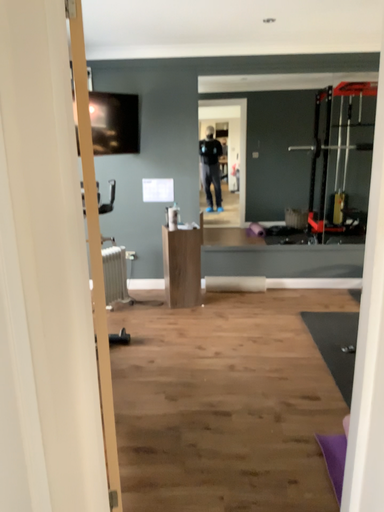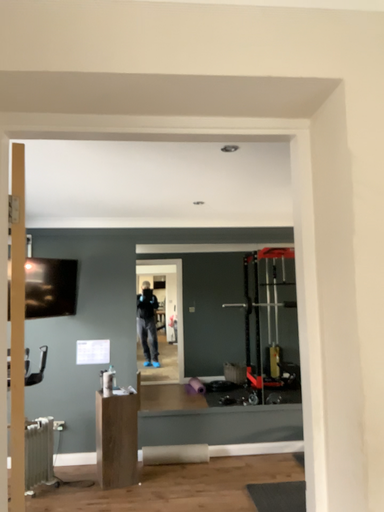
Question: How did the camera likely rotate when shooting the video?

Choices:
 (A) rotated upward
 (B) rotated downward

Answer: (A)